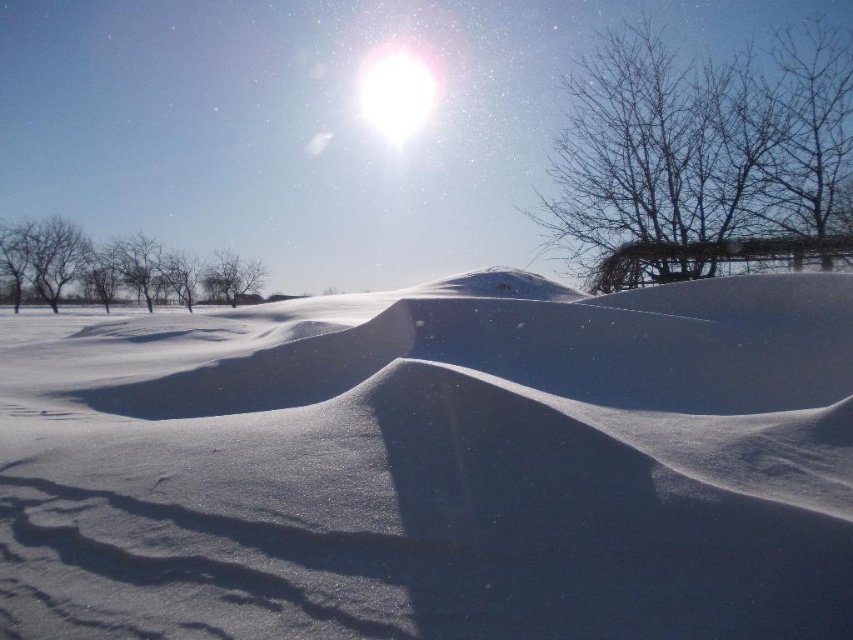
This screenshot has height=640, width=853. I want to click on white fluffy snow at center, so click(x=434, y=465).

Who is shorter, white fluffy snow at center or bare branches at center?

With less height is white fluffy snow at center.

Does point (773, 353) come farther from viewer compared to point (230, 284)?

That is False.

Identify the location of white fluffy snow at center. (434, 465).

Can you confirm if bare branches at upper right is smaller than bare branches at left?

Yes.

Measure the distance between bare branches at upper right and camera.

bare branches at upper right and camera are 22.51 meters apart.

Where is `bare branches at upper right`? The height and width of the screenshot is (640, 853). bare branches at upper right is located at coordinates (698, 145).

Identify the location of bare branches at upper right. (698, 145).

Is bare branches at left in front of bare branches at center?

Yes, bare branches at left is closer to the viewer.

Can you confirm if bare branches at left is positioned above bare branches at center?

Yes.

Identify the location of bare branches at left. This screenshot has height=640, width=853. (115, 268).

The height and width of the screenshot is (640, 853). I want to click on bare branches at left, so click(x=115, y=268).